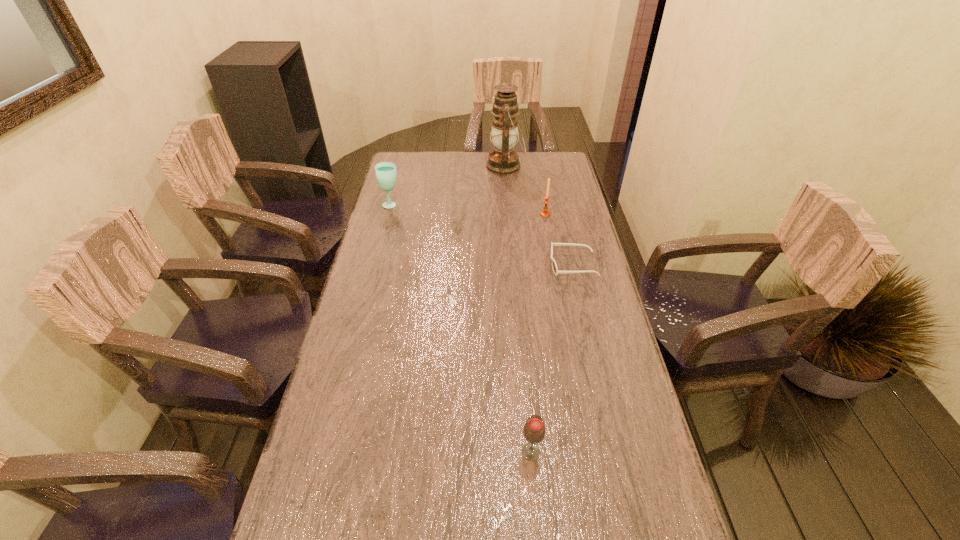
Identify the location of free space at the left edge of the desktop. (395, 240).

In the image, there is a desktop. Identify the location of free space at the right edge. (604, 299).

The height and width of the screenshot is (540, 960). Find the location of `free point between the farther glass drink container and the sunglasses`. free point between the farther glass drink container and the sunglasses is located at coordinates coord(482,234).

At what (x,y) coordinates should I click in order to perform the action: click on free space that is in between the second farthest object and the candle_holder. Please return your answer as a coordinate pair (x, y). Looking at the image, I should click on (468, 209).

Image resolution: width=960 pixels, height=540 pixels. Identify the location of free area in between the candle_holder and the nearest object. (538, 333).

Image resolution: width=960 pixels, height=540 pixels. Identify the location of free space between the candle_holder and the lantern. (525, 190).

Where is `unoccupied area between the candle_holder and the fourth nearest object`? unoccupied area between the candle_holder and the fourth nearest object is located at coordinates (468, 209).

Locate an element on the screen. free spot between the second nearest object and the right glass drink container is located at coordinates (552, 358).

Find the location of a particular element. The image size is (960, 540). vacant area that lies between the lantern and the sunglasses is located at coordinates (540, 215).

Identify the location of free spot between the leftmost object and the third farthest object. pyautogui.click(x=468, y=209).